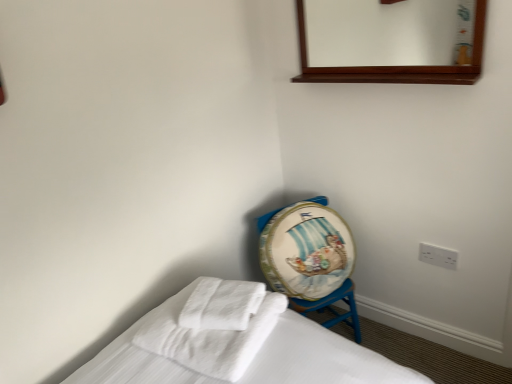
Question: From the image's perspective, does white soft towel at lower left, the second bath towel in the right-to-left sequence, appear lower than wooden mirror at upper center?

Choices:
 (A) no
 (B) yes

Answer: (B)

Question: Is white soft towel at lower left, the second bath towel in the right-to-left sequence, taller than wooden mirror at upper center?

Choices:
 (A) yes
 (B) no

Answer: (B)

Question: Is white soft towel at lower left, the second bath towel in the right-to-left sequence, next to wooden mirror at upper center?

Choices:
 (A) yes
 (B) no

Answer: (B)

Question: Can you confirm if white soft towel at lower left, the 1th bath towel in the left-to-right sequence, is bigger than wooden mirror at upper center?

Choices:
 (A) yes
 (B) no

Answer: (A)

Question: Can you confirm if white soft towel at lower left, the second bath towel in the right-to-left sequence, is wider than wooden mirror at upper center?

Choices:
 (A) no
 (B) yes

Answer: (B)

Question: Does point (429, 8) appear closer or farther from the camera than point (351, 314)?

Choices:
 (A) farther
 (B) closer

Answer: (A)

Question: Is wooden mirror at upper center situated inside painted wood drum at lower right or outside?

Choices:
 (A) outside
 (B) inside

Answer: (A)

Question: Is wooden mirror at upper center in front of or behind painted wood drum at lower right in the image?

Choices:
 (A) front
 (B) behind

Answer: (A)

Question: From the image's perspective, relative to painted wood drum at lower right, is wooden mirror at upper center above or below?

Choices:
 (A) above
 (B) below

Answer: (A)

Question: Would you say white soft towel at lower left, the 1th bath towel in the left-to-right sequence, is inside or outside white plastic electric outlet at lower right?

Choices:
 (A) outside
 (B) inside

Answer: (A)

Question: Considering the positions of white soft towel at lower left, the second bath towel in the right-to-left sequence, and white plastic electric outlet at lower right in the image, is white soft towel at lower left, the second bath towel in the right-to-left sequence, bigger or smaller than white plastic electric outlet at lower right?

Choices:
 (A) big
 (B) small

Answer: (A)

Question: Is white soft towel at lower left, the second bath towel in the right-to-left sequence, wider or thinner than white plastic electric outlet at lower right?

Choices:
 (A) thin
 (B) wide

Answer: (B)

Question: From a real-world perspective, is white soft towel at lower left, the 1th bath towel in the left-to-right sequence, physically located above or below white plastic electric outlet at lower right?

Choices:
 (A) above
 (B) below

Answer: (A)

Question: From their relative heights in the image, would you say wooden mirror at upper center is taller or shorter than white soft towel at center, the 1th bath towel from the right?

Choices:
 (A) tall
 (B) short

Answer: (A)

Question: Based on their sizes in the image, would you say wooden mirror at upper center is bigger or smaller than white soft towel at center, the 1th bath towel from the right?

Choices:
 (A) small
 (B) big

Answer: (B)